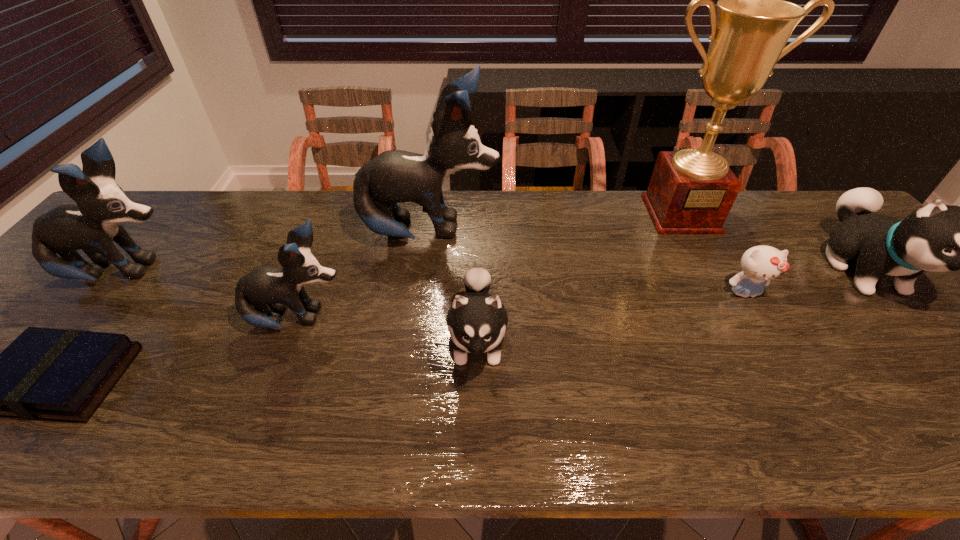
I want to click on the tallest object, so click(691, 191).

You are a GUI agent. You are given a task and a screenshot of the screen. Output one action in this format:
    pyautogui.click(x=<x>, y=<y>)
    Task: Click on the biggest black puppy
    The height and width of the screenshot is (540, 960).
    Given the screenshot: What is the action you would take?
    pyautogui.click(x=394, y=176)

Where is `the tallest puppy`? The height and width of the screenshot is (540, 960). the tallest puppy is located at coordinates (394, 176).

Locate an element on the screen. The height and width of the screenshot is (540, 960). the leftmost black puppy is located at coordinates (92, 225).

At what (x,y) coordinates should I click in order to perform the action: click on the second biggest black puppy. Please return your answer as a coordinate pair (x, y). Looking at the image, I should click on (92, 225).

This screenshot has width=960, height=540. I want to click on the right white puppy, so coord(938,238).

Image resolution: width=960 pixels, height=540 pixels. What are the coordinates of `the rightmost puppy` in the screenshot? It's located at (938, 238).

Where is `the nearest black puppy`? The height and width of the screenshot is (540, 960). the nearest black puppy is located at coordinates click(278, 288).

At what (x,y) coordinates should I click in order to perform the action: click on the left white puppy. Please return your answer as a coordinate pair (x, y). Looking at the image, I should click on (477, 320).

You are a GUI agent. You are given a task and a screenshot of the screen. Output one action in this format:
    pyautogui.click(x=<x>, y=<y>)
    Task: Click on the shortest puppy
    Image resolution: width=960 pixels, height=540 pixels.
    Given the screenshot: What is the action you would take?
    pyautogui.click(x=477, y=320)